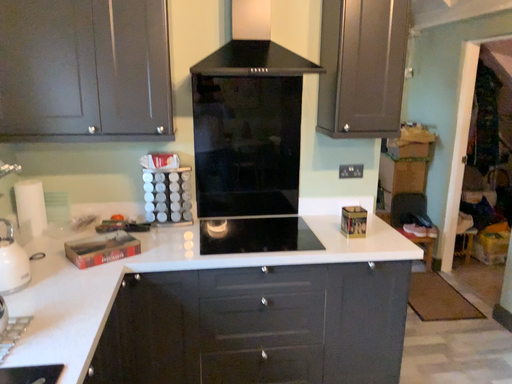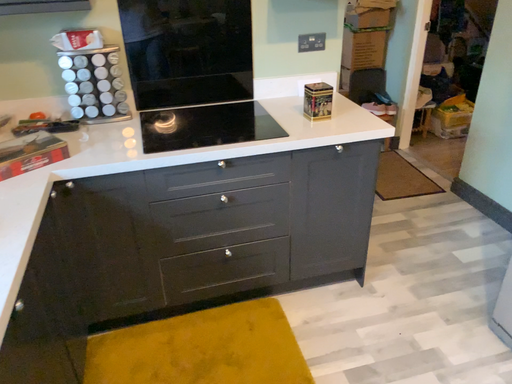
Question: Which way did the camera rotate in the video?

Choices:
 (A) rotated upward
 (B) rotated downward

Answer: (B)